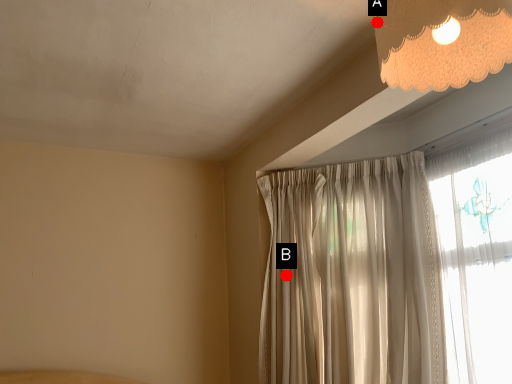
Question: Two points are circled on the image, labeled by A and B beside each circle. Which point appears closest to the camera in this image?

Choices:
 (A) A is closer
 (B) B is closer

Answer: (A)